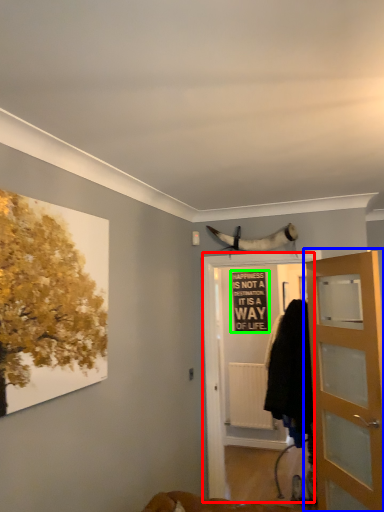
Question: Based on their relative distances, which object is farther from screen door (highlighted by a red box)? Choose from door (highlighted by a blue box) and bulletin board (highlighted by a green box).

Choices:
 (A) door
 (B) bulletin board

Answer: (B)